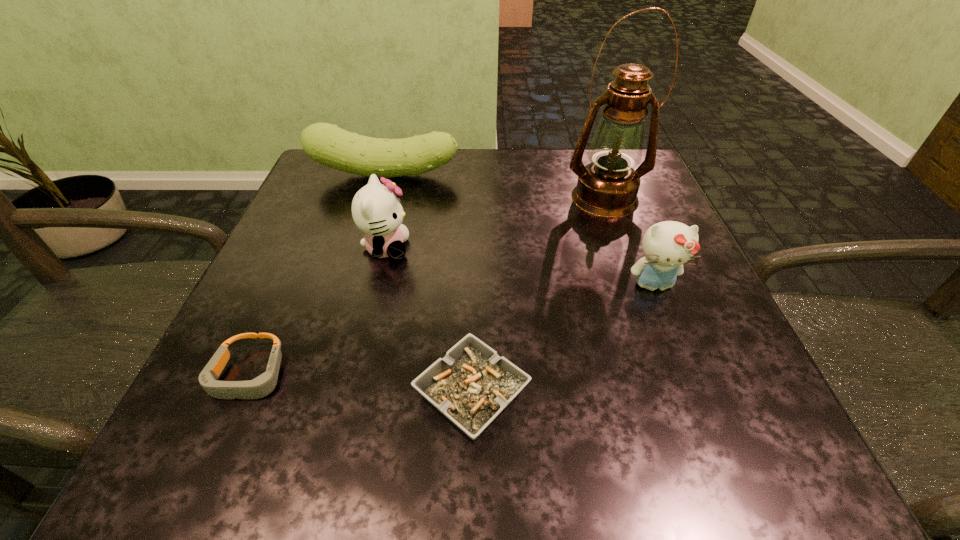
Image resolution: width=960 pixels, height=540 pixels. In order to click on unoccupied area between the left kitten and the right kitten in this screenshot , I will do tap(519, 266).

The height and width of the screenshot is (540, 960). Identify the location of free space that is in between the left kitten and the right kitten. (519, 266).

This screenshot has height=540, width=960. Identify the location of free space between the goggles and the right kitten. (451, 330).

Image resolution: width=960 pixels, height=540 pixels. In order to click on blank region between the left kitten and the ashtray in this screenshot , I will do `click(429, 321)`.

At what (x,y) coordinates should I click in order to perform the action: click on vacant space in between the oil lamp and the goggles. Please return your answer as a coordinate pair (x, y). Looking at the image, I should click on (427, 287).

Image resolution: width=960 pixels, height=540 pixels. In order to click on empty space that is in between the ashtray and the right kitten in this screenshot , I will do `click(563, 340)`.

Locate an element on the screen. The image size is (960, 540). free spot between the oil lamp and the right kitten is located at coordinates (629, 241).

I want to click on free area in between the right kitten and the oil lamp, so point(629,241).

Where is `unoccupied position between the oil lamp and the goggles`? This screenshot has width=960, height=540. unoccupied position between the oil lamp and the goggles is located at coordinates (427, 287).

Find the location of `empty location between the right kitten and the goggles`. empty location between the right kitten and the goggles is located at coordinates (451, 330).